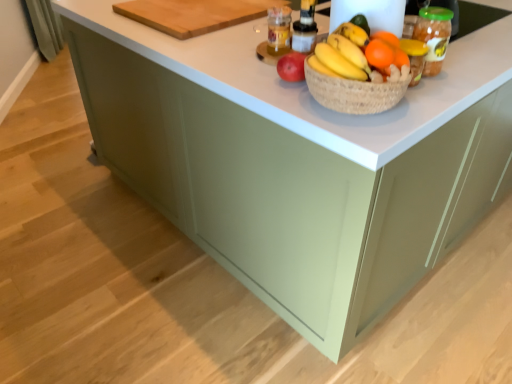
Find the location of a particular element. This screenshot has width=512, height=384. free region on the left part of orange matte at upper right is located at coordinates (337, 70).